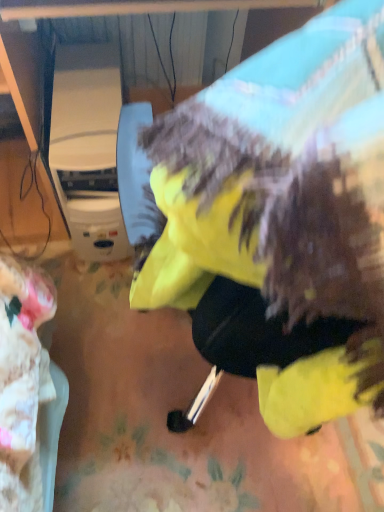
Identify the location of white plastic appliance at left. (88, 148).

Describe the element at coordinates (88, 148) in the screenshot. I see `white plastic appliance at left` at that location.

Where is `white plastic appliance at left`? white plastic appliance at left is located at coordinates (88, 148).